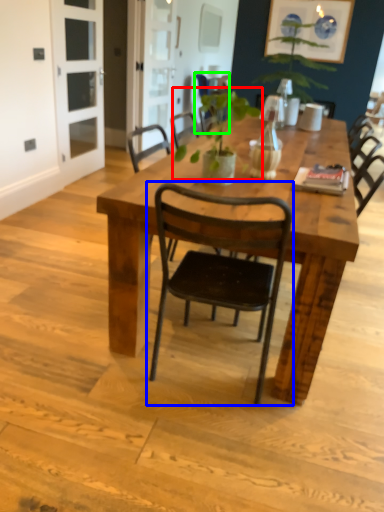
Question: Estimate the real-world distances between objects in this image. Which object is closer to plant (highlighted by a red box), chair (highlighted by a blue box) or chair (highlighted by a green box)?

Choices:
 (A) chair
 (B) chair

Answer: (B)